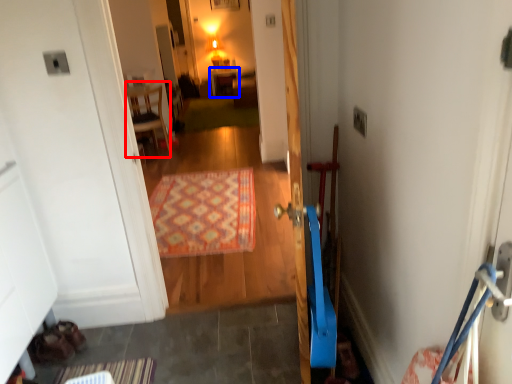
Question: Which point is further to the camera, furniture (highlighted by a red box) or furniture (highlighted by a blue box)?

Choices:
 (A) furniture
 (B) furniture

Answer: (B)